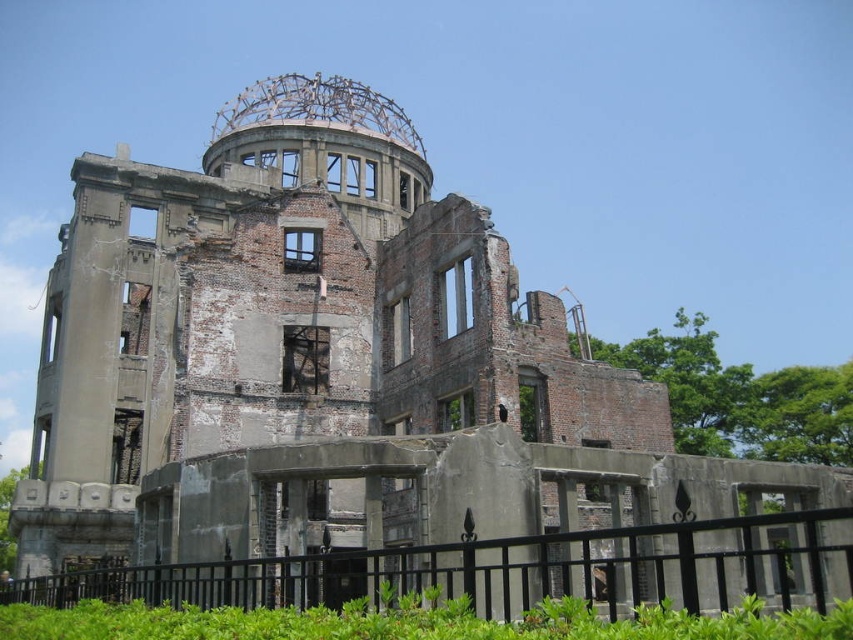
You are a tourist standing in front of the Atomic Bomb Dome. You see the concrete ruins at center and the black metal fence at lower center. Which object is taller?

The concrete ruins at center is taller than the black metal fence at lower center.

You are a tourist standing in front of the Atomic Bomb Dome. You notice the concrete ruins at center and the black metal fence at lower center. Which object is closer to you?

The concrete ruins at center is closer to you than the black metal fence at lower center because the description states that the concrete ruins at center is further to the viewer than black metal fence at lower center.

You are a photographer standing in front of the Atomic Bomb Dome. You want to take a photo that includes both the point at coordinates point (51, 392) and point (804, 577). Which point will appear closer to the camera in your photo?

Point (51, 392) is further to the camera than point (804, 577), so in the photo, point (51, 392) will appear closer to the camera than point (804, 577).